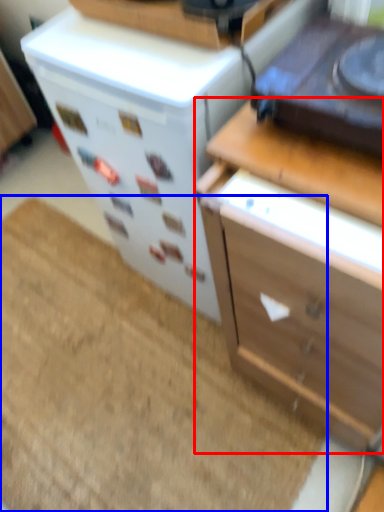
Question: Among these objects, which one is nearest to the camera, chest of drawers (highlighted by a red box) or doormat (highlighted by a blue box)?

Choices:
 (A) chest of drawers
 (B) doormat

Answer: (A)